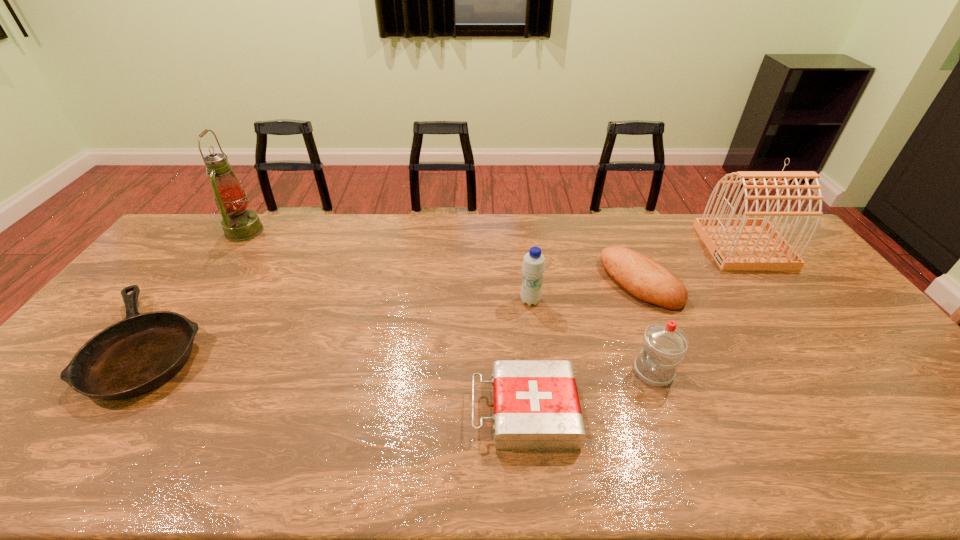
At what (x,y) coordinates should I click in order to perform the action: click on oil lamp positioned at the far edge. Please return your answer as a coordinate pair (x, y). Looking at the image, I should click on (239, 224).

Locate an element on the screen. Image resolution: width=960 pixels, height=540 pixels. birdcage at the far edge is located at coordinates (745, 243).

Find the location of a particular element. Image resolution: width=960 pixels, height=540 pixels. object at the near edge is located at coordinates (536, 405).

Locate an element on the screen. The height and width of the screenshot is (540, 960). object at the left edge is located at coordinates (134, 356).

This screenshot has height=540, width=960. What are the coordinates of `object that is at the right edge` in the screenshot? It's located at (745, 243).

Identify the location of object that is at the far right corner. (745, 243).

Image resolution: width=960 pixels, height=540 pixels. In the image, there is a desktop. In order to click on free space at the far edge in this screenshot , I will do `click(655, 244)`.

Identify the location of vacant space at the near edge of the desktop. This screenshot has height=540, width=960. (471, 470).

Where is `vacant region at the left edge of the desktop`? Image resolution: width=960 pixels, height=540 pixels. vacant region at the left edge of the desktop is located at coordinates (106, 317).

Where is `vacant point located between the birdcage and the second shortest object`? The height and width of the screenshot is (540, 960). vacant point located between the birdcage and the second shortest object is located at coordinates (634, 329).